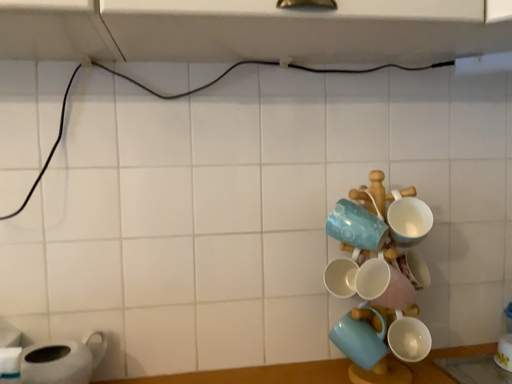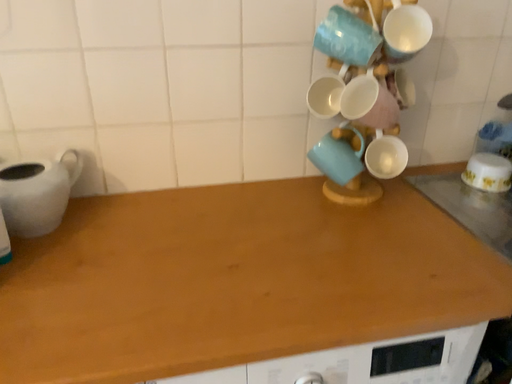
Question: How did the camera likely rotate when shooting the video?

Choices:
 (A) rotated downward
 (B) rotated upward

Answer: (A)